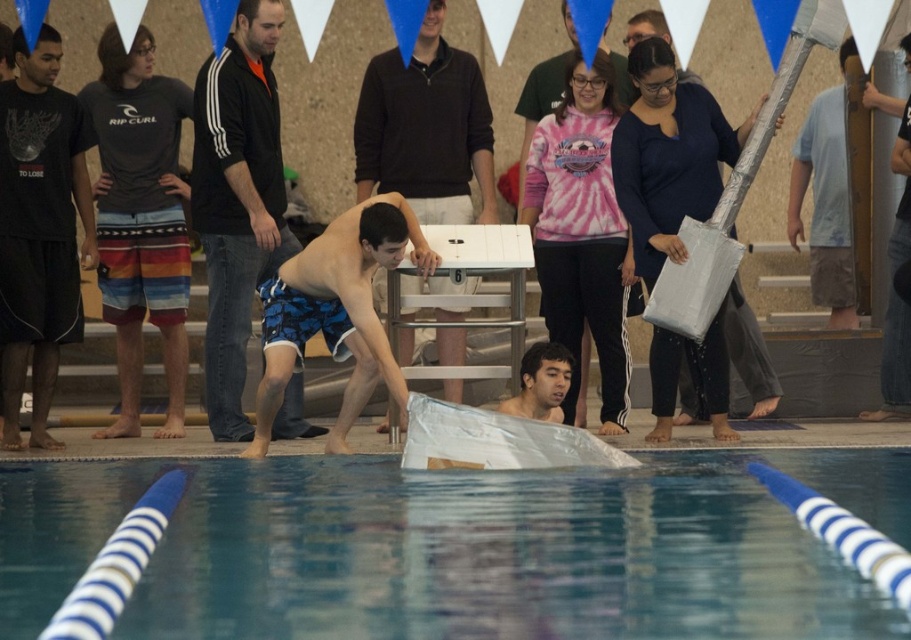
What is the exact location of the silver reflective guitar at center in the image?

The silver reflective guitar at center is located at point coordinates of [750,355].